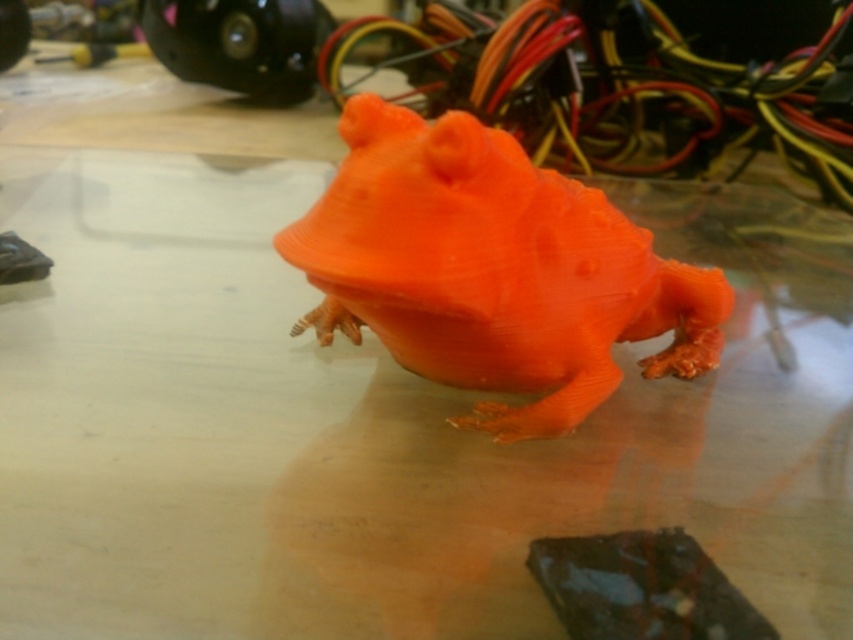
Is point (576, 360) more distant than point (529, 51)?

No, (576, 360) is closer to viewer.

In the scene shown: Does orange matte plastic frog at center appear under orange matte wire at upper center?

Yes, orange matte plastic frog at center is below orange matte wire at upper center.

Who is more distant from viewer, (561, 376) or (727, 138)?

Positioned behind is point (727, 138).

The image size is (853, 640). I want to click on orange matte plastic frog at center, so click(x=492, y=269).

Can you confirm if orange matte wire at upper center is positioned to the left of dark chocolate bar at lower right?

No, orange matte wire at upper center is not to the left of dark chocolate bar at lower right.

Is orange matte wire at upper center to the right of dark chocolate bar at lower right from the viewer's perspective?

Correct, you'll find orange matte wire at upper center to the right of dark chocolate bar at lower right.

Between point (621, 116) and point (581, 605), which one is positioned in front?

Point (581, 605)

Identify the location of orange matte wire at upper center. (608, 88).

Is point (463, 160) farther from viewer compared to point (682, 538)?

No, it is in front of (682, 538).

Is orange matte plastic frog at center behind dark chocolate bar at lower right?

Yes, it is behind dark chocolate bar at lower right.

I want to click on orange matte plastic frog at center, so click(492, 269).

At what (x,y) coordinates should I click in order to perform the action: click on orange matte plastic frog at center. Please return your answer as a coordinate pair (x, y). The width and height of the screenshot is (853, 640). Looking at the image, I should click on (492, 269).